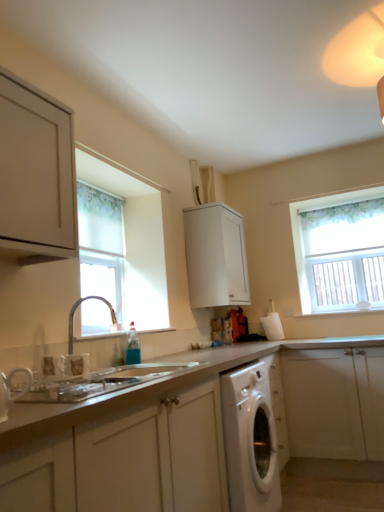
Question: From the image's perspective, does white textured window at upper right, the second window viewed from the front, appear higher than white glossy washing machine at lower center?

Choices:
 (A) no
 (B) yes

Answer: (B)

Question: Is white textured window at upper right, the second window viewed from the front, bigger than white glossy washing machine at lower center?

Choices:
 (A) yes
 (B) no

Answer: (B)

Question: Considering the relative positions of white textured window at upper right, the 1th window from the back, and white glossy washing machine at lower center in the image provided, is white textured window at upper right, the 1th window from the back, to the right of white glossy washing machine at lower center from the viewer's perspective?

Choices:
 (A) yes
 (B) no

Answer: (A)

Question: Does white textured window at upper right, which is counted as the second window, starting from the left, have a smaller size compared to white glossy washing machine at lower center?

Choices:
 (A) yes
 (B) no

Answer: (A)

Question: Is white textured window at upper right, the second window viewed from the front, in contact with white glossy washing machine at lower center?

Choices:
 (A) yes
 (B) no

Answer: (B)

Question: From their relative heights in the image, would you say white matte cabinet at lower center, placed as the first cabinetry when sorted from front to back, is taller or shorter than matte white cabinet at upper left, which appears as the third cabinetry when viewed from the back?

Choices:
 (A) short
 (B) tall

Answer: (B)

Question: Considering the positions of point (137, 465) and point (18, 208), is point (137, 465) closer or farther from the camera than point (18, 208)?

Choices:
 (A) farther
 (B) closer

Answer: (B)

Question: Considering the positions of white matte cabinet at lower center, placed as the first cabinetry when sorted from front to back, and matte white cabinet at upper left, which appears as the third cabinetry when viewed from the back, in the image, is white matte cabinet at lower center, placed as the first cabinetry when sorted from front to back, bigger or smaller than matte white cabinet at upper left, which appears as the third cabinetry when viewed from the back,?

Choices:
 (A) small
 (B) big

Answer: (B)

Question: Considering the relative positions of white matte cabinet at lower center, the fourth cabinetry when ordered from back to front, and matte white cabinet at upper left, the 2th cabinetry when ordered from front to back, in the image provided, is white matte cabinet at lower center, the fourth cabinetry when ordered from back to front, to the left or to the right of matte white cabinet at upper left, the 2th cabinetry when ordered from front to back,?

Choices:
 (A) left
 (B) right

Answer: (B)

Question: Visually, is white textured window at upper right, the second window viewed from the front, positioned to the left or to the right of silver metallic tap at lower left?

Choices:
 (A) right
 (B) left

Answer: (A)

Question: From their relative heights in the image, would you say white textured window at upper right, which is counted as the second window, starting from the left, is taller or shorter than silver metallic tap at lower left?

Choices:
 (A) tall
 (B) short

Answer: (A)

Question: Looking at the image, does white textured window at upper right, the first window in the right-to-left sequence, seem bigger or smaller compared to silver metallic tap at lower left?

Choices:
 (A) small
 (B) big

Answer: (B)

Question: Relative to silver metallic tap at lower left, is white textured window at upper right, which is counted as the second window, starting from the left, in front or behind?

Choices:
 (A) front
 (B) behind

Answer: (B)

Question: Considering the relative positions of silver metallic tap at lower left and white matte cabinet at lower center, placed as the first cabinetry when sorted from front to back, in the image provided, is silver metallic tap at lower left to the left or to the right of white matte cabinet at lower center, placed as the first cabinetry when sorted from front to back,?

Choices:
 (A) right
 (B) left

Answer: (B)

Question: From a real-world perspective, relative to white matte cabinet at lower center, the fourth cabinetry when ordered from back to front, is silver metallic tap at lower left vertically above or below?

Choices:
 (A) above
 (B) below

Answer: (A)